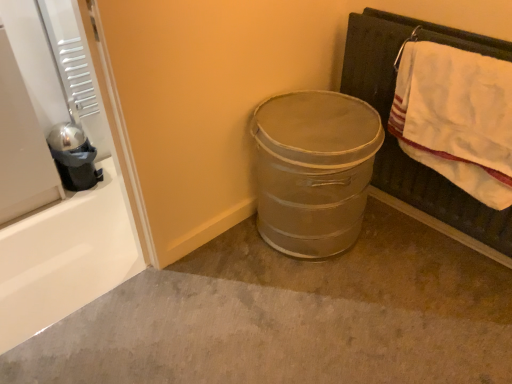
Question: From a real-world perspective, is metallic gray trash can at center physically below metallic gray trash can at center?

Choices:
 (A) yes
 (B) no

Answer: (B)

Question: Is metallic gray trash can at center positioned beyond the bounds of metallic gray trash can at center?

Choices:
 (A) no
 (B) yes

Answer: (B)

Question: Is metallic gray trash can at center positioned before metallic gray trash can at center?

Choices:
 (A) yes
 (B) no

Answer: (B)

Question: Considering the relative sizes of metallic gray trash can at center and metallic gray trash can at center in the image provided, is metallic gray trash can at center wider than metallic gray trash can at center?

Choices:
 (A) no
 (B) yes

Answer: (A)

Question: From a real-world perspective, does metallic gray trash can at center stand above metallic gray trash can at center?

Choices:
 (A) yes
 (B) no

Answer: (A)

Question: Considering the positions of metallic gray trash can at center and shiny metallic pot at left in the image, is metallic gray trash can at center bigger or smaller than shiny metallic pot at left?

Choices:
 (A) big
 (B) small

Answer: (A)

Question: Is point (262, 193) positioned closer to the camera than point (62, 135)?

Choices:
 (A) farther
 (B) closer

Answer: (B)

Question: From a real-world perspective, is metallic gray trash can at center positioned above or below shiny metallic pot at left?

Choices:
 (A) below
 (B) above

Answer: (B)

Question: From the image's perspective, is metallic gray trash can at center above or below shiny metallic pot at left?

Choices:
 (A) below
 (B) above

Answer: (A)

Question: From a real-world perspective, is metallic gray trash can at center positioned above or below white cotton towel at upper right?

Choices:
 (A) above
 (B) below

Answer: (B)

Question: Is metallic gray trash can at center taller or shorter than white cotton towel at upper right?

Choices:
 (A) tall
 (B) short

Answer: (A)

Question: From the image's perspective, is metallic gray trash can at center above or below white cotton towel at upper right?

Choices:
 (A) below
 (B) above

Answer: (A)

Question: Would you say metallic gray trash can at center is to the left or to the right of white cotton towel at upper right in the picture?

Choices:
 (A) left
 (B) right

Answer: (A)

Question: Is point (488, 173) positioned closer to the camera than point (67, 148)?

Choices:
 (A) farther
 (B) closer

Answer: (B)

Question: Considering the positions of white cotton towel at upper right and shiny metallic pot at left in the image, is white cotton towel at upper right wider or thinner than shiny metallic pot at left?

Choices:
 (A) thin
 (B) wide

Answer: (A)